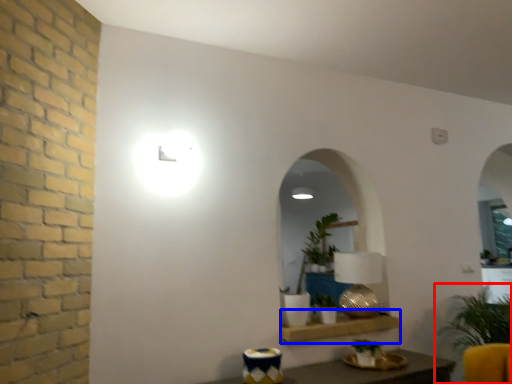
Question: Among these objects, which one is farthest to the camera, houseplant (highlighted by a red box) or shelf (highlighted by a blue box)?

Choices:
 (A) houseplant
 (B) shelf

Answer: (B)